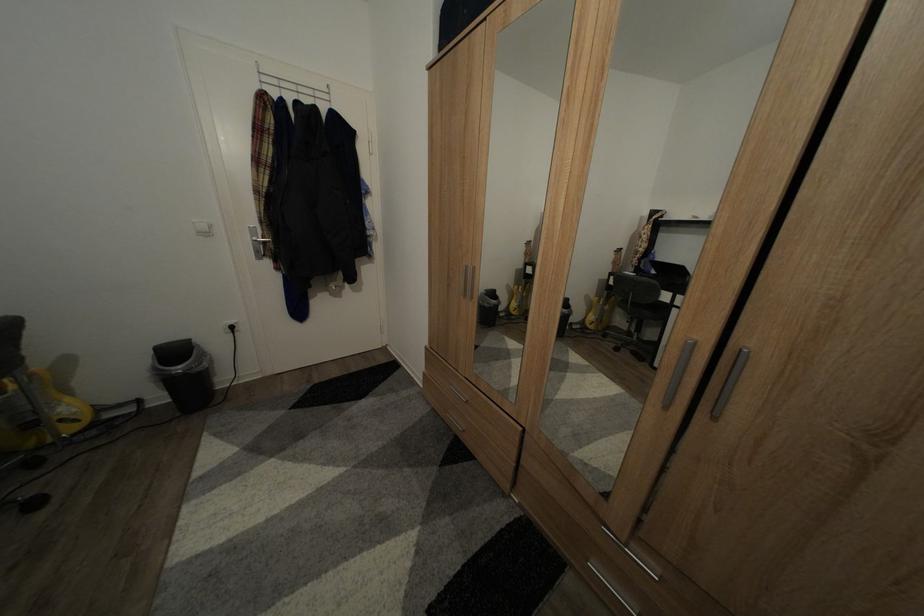
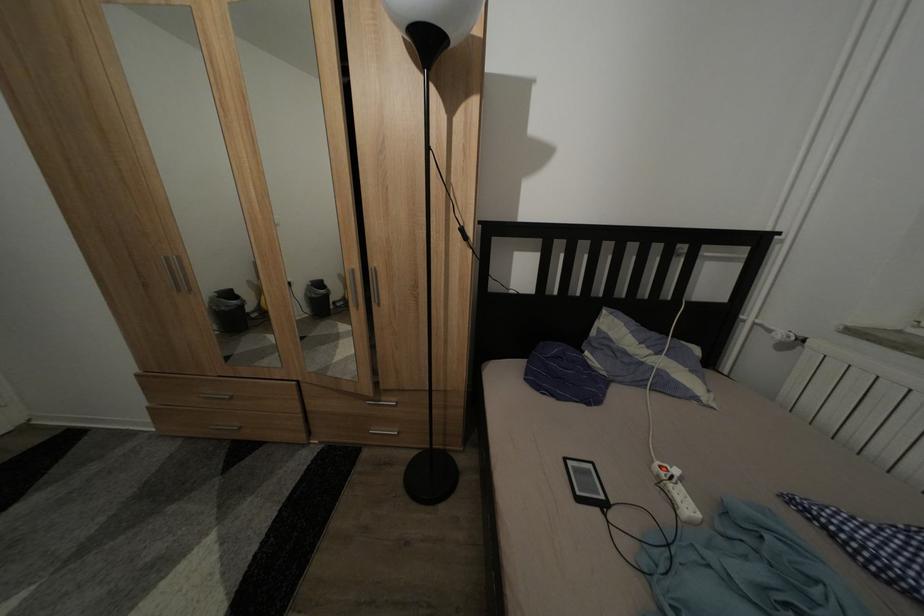
Locate, in the second image, the point that corresponds to point 475,273 in the first image.

(175, 265)